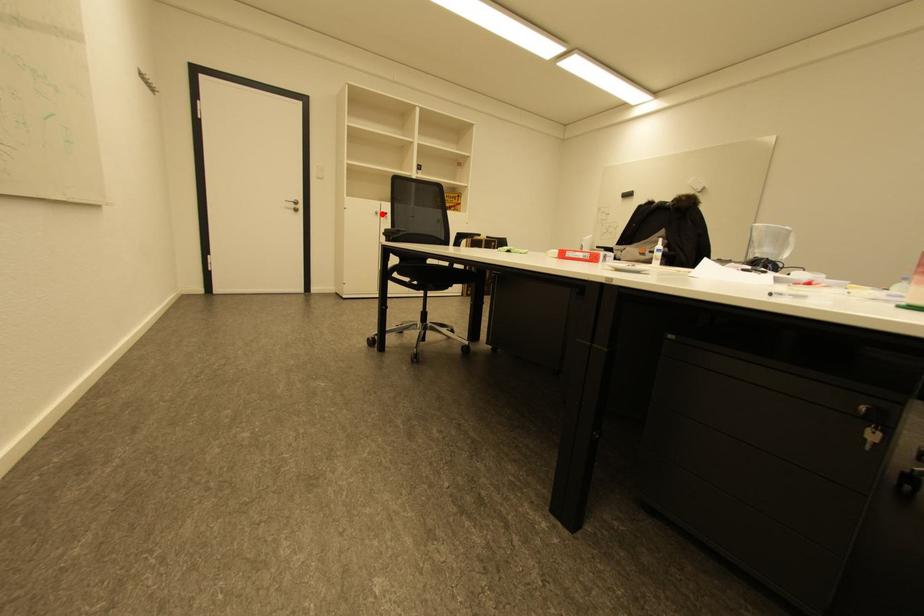
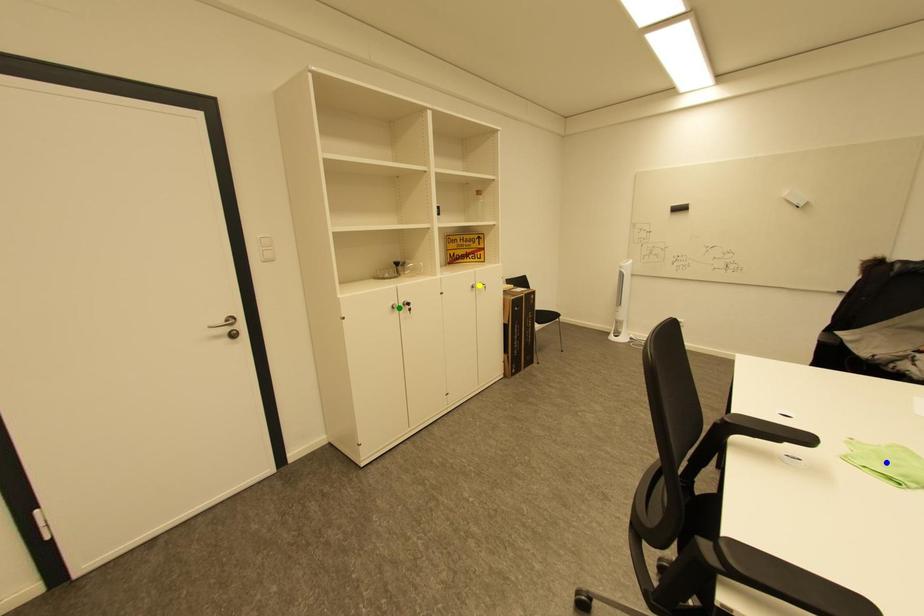
Question: I am providing you with two images of the same scene from different viewpoints. A red point is marked on the first image. You are given multiple points on the second image. Which mark in image 2 goes with the point in image 1?

Choices:
 (A) yellow point
 (B) blue point
 (C) green point

Answer: (C)